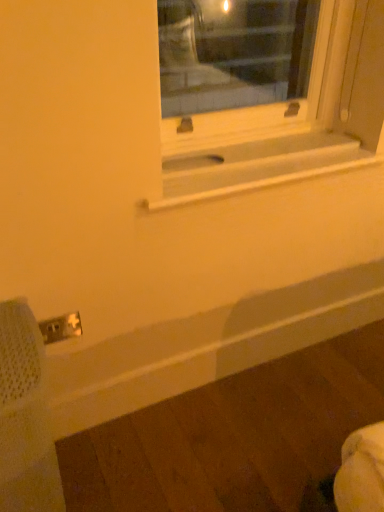
Question: Can we say white plastic electric outlet at lower left lies outside white matte window sill at center?

Choices:
 (A) no
 (B) yes

Answer: (B)

Question: Is white plastic electric outlet at lower left thinner than white matte window sill at center?

Choices:
 (A) no
 (B) yes

Answer: (B)

Question: Does white plastic electric outlet at lower left lie in front of white matte window sill at center?

Choices:
 (A) yes
 (B) no

Answer: (B)

Question: Is white plastic electric outlet at lower left to the left of white matte window sill at center from the viewer's perspective?

Choices:
 (A) yes
 (B) no

Answer: (A)

Question: Is white plastic electric outlet at lower left placed right next to white matte window sill at center?

Choices:
 (A) no
 (B) yes

Answer: (A)

Question: Can you confirm if white plastic electric outlet at lower left is bigger than white matte window sill at center?

Choices:
 (A) no
 (B) yes

Answer: (A)

Question: Considering the relative sizes of white plastic electric outlet at lower left and metal mesh swivel chair at lower left in the image provided, is white plastic electric outlet at lower left bigger than metal mesh swivel chair at lower left?

Choices:
 (A) yes
 (B) no

Answer: (B)

Question: From the image's perspective, is white plastic electric outlet at lower left below metal mesh swivel chair at lower left?

Choices:
 (A) no
 (B) yes

Answer: (A)

Question: Is white plastic electric outlet at lower left looking in the opposite direction of metal mesh swivel chair at lower left?

Choices:
 (A) no
 (B) yes

Answer: (A)

Question: Does white plastic electric outlet at lower left lie behind metal mesh swivel chair at lower left?

Choices:
 (A) no
 (B) yes

Answer: (B)

Question: Is white plastic electric outlet at lower left to the right of metal mesh swivel chair at lower left from the viewer's perspective?

Choices:
 (A) yes
 (B) no

Answer: (A)

Question: Is white plastic electric outlet at lower left positioned before metal mesh swivel chair at lower left?

Choices:
 (A) no
 (B) yes

Answer: (A)

Question: Is white matte window sill at center in front of white plastic electric outlet at lower left?

Choices:
 (A) yes
 (B) no

Answer: (A)